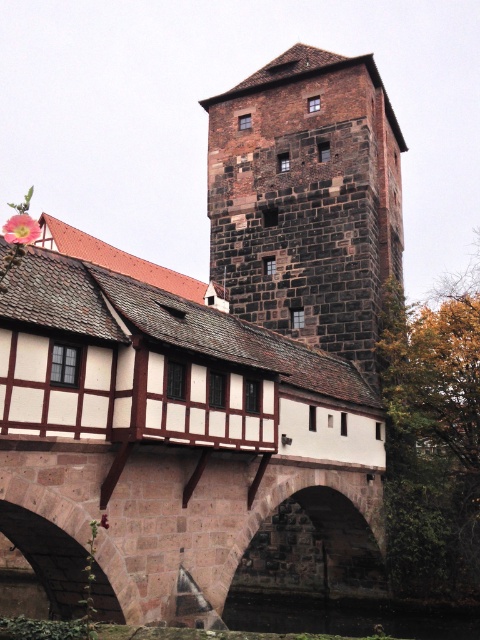
Question: Does dark brown stone tower at upper center appear over brown stone bridge at center?

Choices:
 (A) yes
 (B) no

Answer: (A)

Question: Among these points, which one is nearest to the camera?

Choices:
 (A) (311, 145)
 (B) (389, 608)

Answer: (B)

Question: Which point is farther to the camera?

Choices:
 (A) (49, 554)
 (B) (289, 609)

Answer: (B)

Question: Does brown stone bridge at center come behind black stone river at lower center?

Choices:
 (A) yes
 (B) no

Answer: (B)

Question: Which object is positioned farthest from the brown stone bridge at center?

Choices:
 (A) black stone river at lower center
 (B) dark brown stone tower at upper center

Answer: (B)

Question: Does brown stone bridge at center have a greater width compared to black stone river at lower center?

Choices:
 (A) no
 (B) yes

Answer: (B)